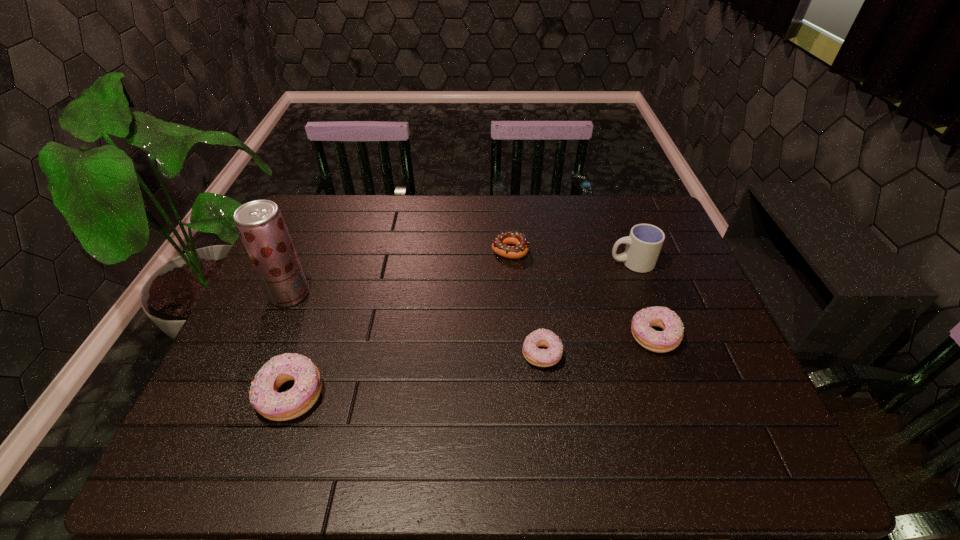
At what (x,y) coordinates should I click in order to perform the action: click on the tallest doughnut. Please return your answer as a coordinate pair (x, y). The width and height of the screenshot is (960, 540). Looking at the image, I should click on point(264,397).

Find the location of `the leftmost doughnut`. the leftmost doughnut is located at coordinates [x=264, y=397].

Find the location of a particular element. the rightmost doughnut is located at coordinates (667, 340).

Identify the location of the fourth tallest object. (667, 340).

I want to click on the farthest doughnut, so click(x=499, y=245).

In order to click on the third farthest object in this screenshot , I will do `click(260, 224)`.

The height and width of the screenshot is (540, 960). I want to click on the tallest object, so click(260, 224).

Locate an element on the screen. The image size is (960, 540). cup is located at coordinates (644, 243).

Identify the location of free space located on the right of the tallest doughnut. (501, 395).

The width and height of the screenshot is (960, 540). In order to click on vacant space located on the right of the third shortest object in this screenshot , I will do `click(709, 336)`.